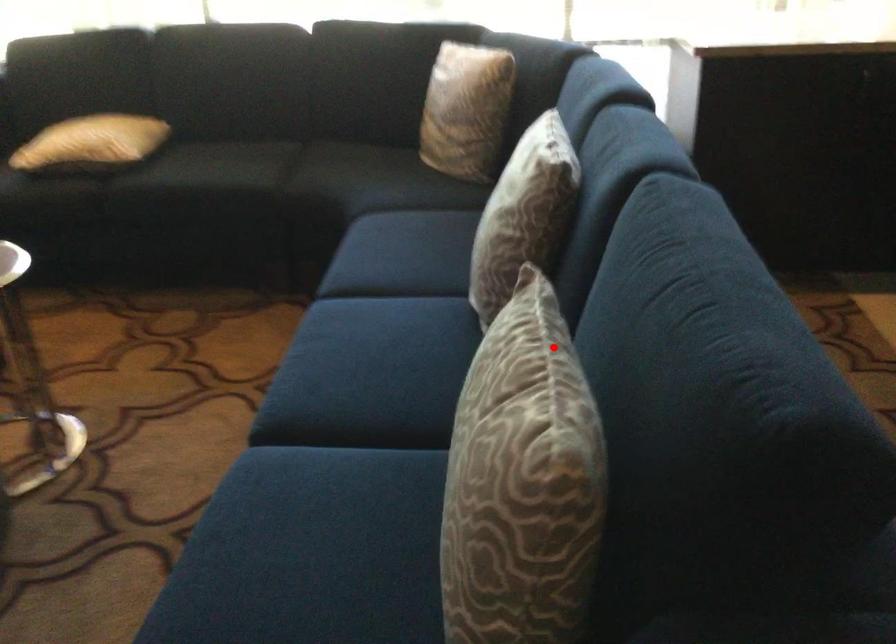
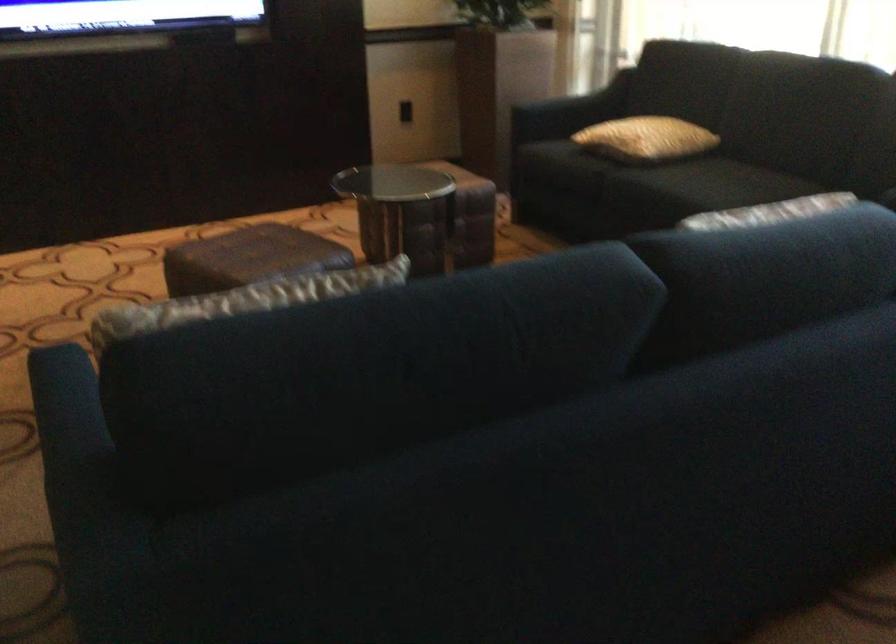
Question: I am providing you with two images of the same scene from different viewpoints. A red point is shown in image1. For the corresponding object point in image2, is it positioned nearer or farther from the camera?

Choices:
 (A) Nearer
 (B) Farther

Answer: (B)